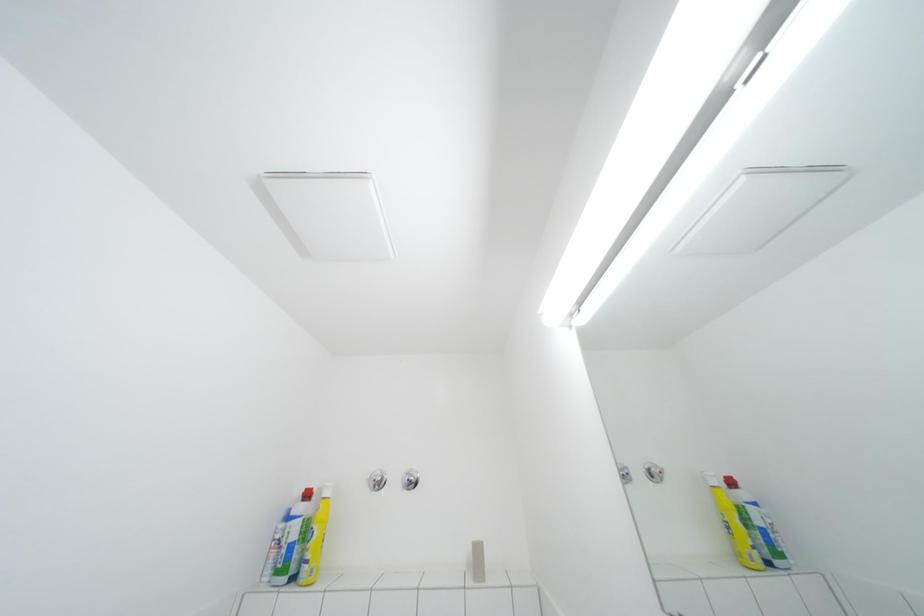
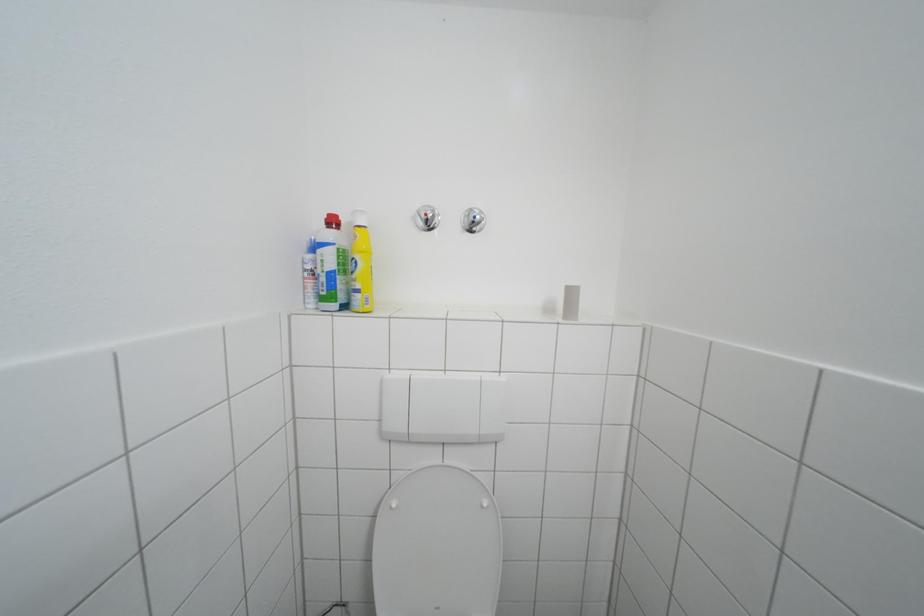
Question: The images are taken continuously from a first-person perspective. In which direction is your viewpoint rotating?

Choices:
 (A) Left
 (B) Right
 (C) Up
 (D) Down

Answer: (D)